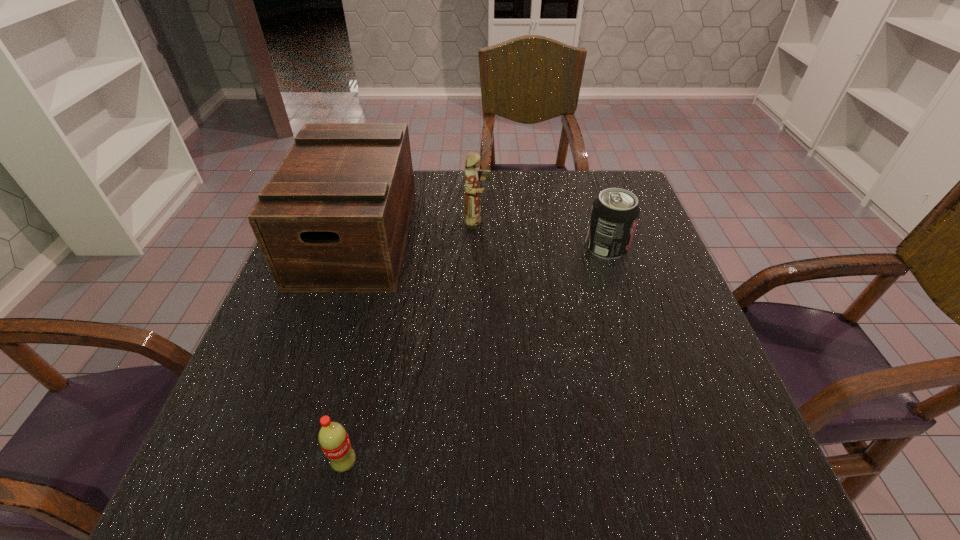
The image size is (960, 540). Identify the location of object that stands as the closest to the third object from left to right. (334, 218).

The width and height of the screenshot is (960, 540). In order to click on object that is the closest to the nearer soda in this screenshot , I will do `click(334, 218)`.

Find the location of a particular element. Image resolution: width=960 pixels, height=540 pixels. blank space that satisfies the following two spatial constraints: 1. on the front-facing side of the third object from left to right; 2. on the front side of the nearer soda is located at coordinates (476, 463).

Find the location of a particular element. This screenshot has width=960, height=540. vacant space that satisfies the following two spatial constraints: 1. on the front-facing side of the second object from right to left; 2. on the back side of the farther soda is located at coordinates (478, 247).

At what (x,y) coordinates should I click in order to perform the action: click on free space that satisfies the following two spatial constraints: 1. on the front-facing side of the right soda; 2. on the left side of the figurine. Please return your answer as a coordinate pair (x, y). This screenshot has width=960, height=540. Looking at the image, I should click on (478, 247).

This screenshot has width=960, height=540. What are the coordinates of `free point that satisfies the following two spatial constraints: 1. on the back side of the farther soda; 2. on the right side of the nearer soda` in the screenshot? It's located at (393, 247).

Where is `vacant area in the image that satisfies the following two spatial constraints: 1. on the back side of the farther soda; 2. on the right side of the nearer soda`? Image resolution: width=960 pixels, height=540 pixels. vacant area in the image that satisfies the following two spatial constraints: 1. on the back side of the farther soda; 2. on the right side of the nearer soda is located at coordinates (393, 247).

In order to click on vacant region that satisfies the following two spatial constraints: 1. on the front-facing side of the rightmost object; 2. on the right side of the second object from right to left in this screenshot , I will do `click(478, 247)`.

This screenshot has width=960, height=540. Find the location of `vacant space that satisfies the following two spatial constraints: 1. on the front-facing side of the figurine; 2. on the front side of the nearer soda`. vacant space that satisfies the following two spatial constraints: 1. on the front-facing side of the figurine; 2. on the front side of the nearer soda is located at coordinates (476, 463).